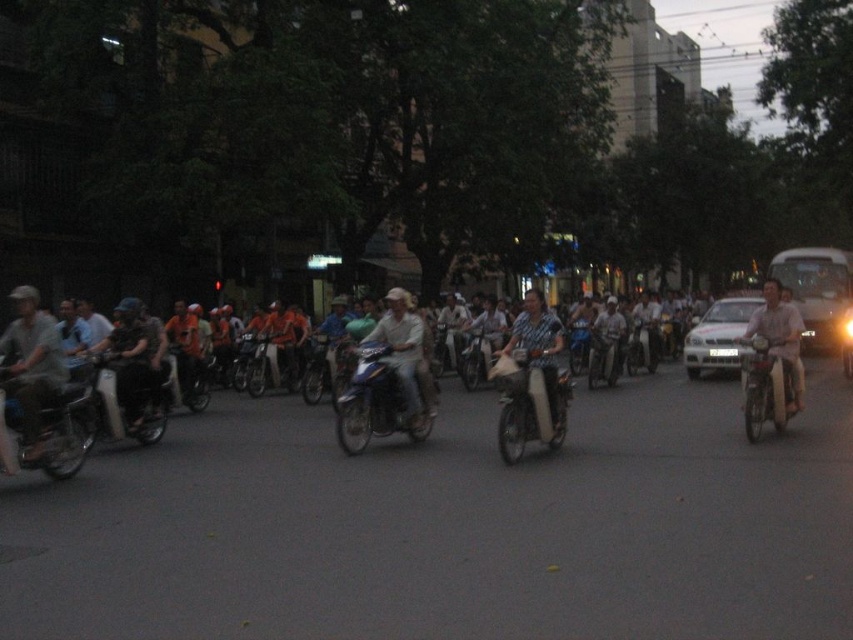
You are a delivery person trying to navigate through the street scene. You need to pass between the matte black motorcycle at center and the light beige fabric shirt at center. Can your delivery vehicle, which is 1.2 meters wide, fit through the space between them?

The matte black motorcycle at center has a lesser width compared to the light beige fabric shirt at center. However, without knowing the exact width of either object, it is impossible to determine if the 1.2 meter wide delivery vehicle can fit through the space between them.

You are a delivery person who needs to carry a large package that requires a vehicle with more space. You see a metallic silver scooter at left and a light brown leather jacket at right. Which vehicle should you choose?

The light brown leather jacket at right occupies more space than the metallic silver scooter at left, so you should choose the light brown leather jacket at right.